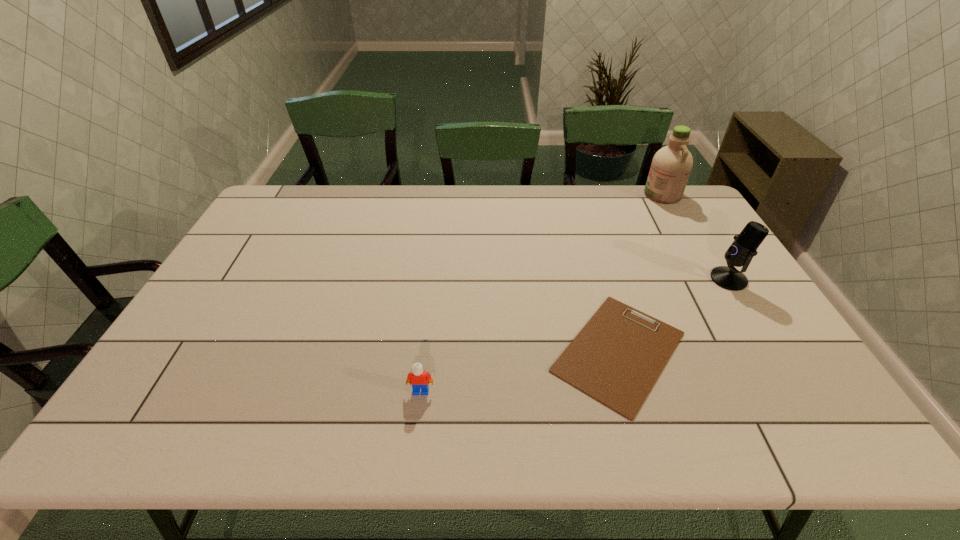
Where is `object located at the far right corner`? The height and width of the screenshot is (540, 960). object located at the far right corner is located at coordinates (671, 165).

Where is `vacant area at the far edge`? The height and width of the screenshot is (540, 960). vacant area at the far edge is located at coordinates (615, 198).

This screenshot has width=960, height=540. I want to click on free region at the near edge of the desktop, so click(x=584, y=435).

In the image, there is a desktop. Identify the location of vacant space at the left edge. (200, 348).

Find the location of `free space at the right edge of the desktop`. free space at the right edge of the desktop is located at coordinates (692, 274).

Locate an element on the screen. Image resolution: width=960 pixels, height=540 pixels. free space at the far right corner is located at coordinates (700, 221).

The height and width of the screenshot is (540, 960). What are the coordinates of `empty space that is in between the second shortest object and the second object from left to right` in the screenshot? It's located at (520, 372).

At what (x,y) coordinates should I click in order to perform the action: click on empty space that is in between the farthest object and the shortest object. Please return your answer as a coordinate pair (x, y). The image size is (960, 540). Looking at the image, I should click on (640, 273).

Identify the location of empty space between the shortest object and the farthest object. (640, 273).

The width and height of the screenshot is (960, 540). What are the coordinates of `unoccupied area between the clipboard and the second farthest object` in the screenshot? It's located at (674, 315).